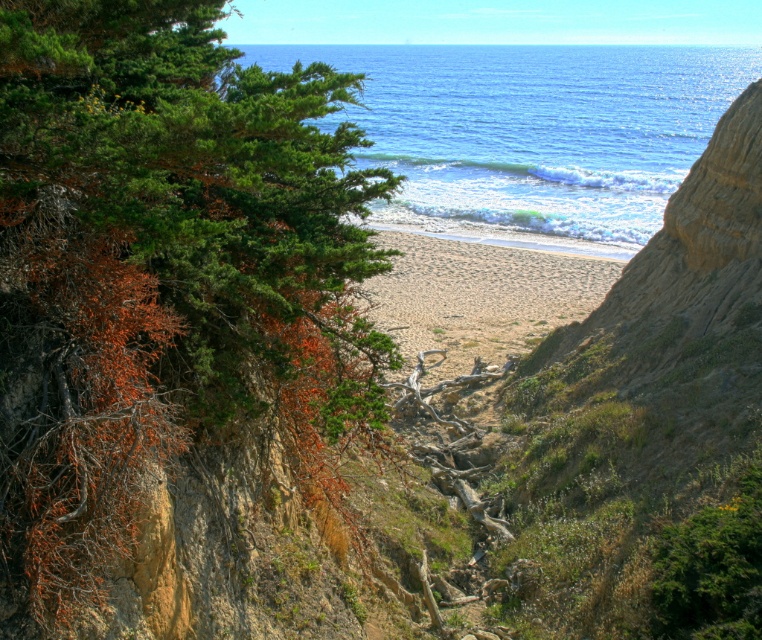
Is point (85, 406) farther from viewer compared to point (709, 81)?

No, it is in front of (709, 81).

I want to click on green leafy tree at left, so click(x=162, y=268).

Is point (210, 61) closer to viewer compared to point (719, 86)?

Yes, it is in front of point (719, 86).

You are a GUI agent. You are given a task and a screenshot of the screen. Output one action in this format:
    pyautogui.click(x=<x>, y=<y>)
    Task: Click on the green leafy tree at left
    The image size is (762, 640).
    Given the screenshot: What is the action you would take?
    pyautogui.click(x=162, y=268)